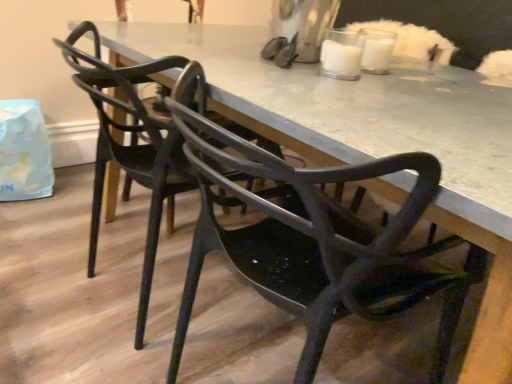
Question: Is matte black chair at center, which is counted as the 1th chair, starting from the front, in front of matte black chair at center, placed as the 1th chair when sorted from back to front?

Choices:
 (A) yes
 (B) no

Answer: (A)

Question: From a real-world perspective, is matte black chair at center, which is counted as the 1th chair, starting from the front, over matte black chair at center, placed as the 1th chair when sorted from back to front?

Choices:
 (A) no
 (B) yes

Answer: (A)

Question: Is matte black chair at center, which is counted as the 1th chair, starting from the front, far away from matte black chair at center, placed as the 1th chair when sorted from back to front?

Choices:
 (A) no
 (B) yes

Answer: (A)

Question: Considering the relative sizes of matte black chair at center, arranged as the 2th chair when viewed from the back, and matte black chair at center, placed as the 1th chair when sorted from back to front, in the image provided, is matte black chair at center, arranged as the 2th chair when viewed from the back, bigger than matte black chair at center, placed as the 1th chair when sorted from back to front,?

Choices:
 (A) yes
 (B) no

Answer: (B)

Question: Is matte black chair at center, which is counted as the 1th chair, starting from the front, outside of matte black chair at center, placed as the 1th chair when sorted from back to front?

Choices:
 (A) yes
 (B) no

Answer: (A)

Question: Is matte black chair at center, arranged as the 2th chair when viewed from the back, wider or thinner than matte black chair at center, placed as the 1th chair when sorted from back to front?

Choices:
 (A) thin
 (B) wide

Answer: (A)

Question: Is matte black chair at center, which is counted as the 1th chair, starting from the front, taller or shorter than matte black chair at center, acting as the 2th chair starting from the front?

Choices:
 (A) tall
 (B) short

Answer: (A)

Question: Considering the relative positions of matte black chair at center, which is counted as the 1th chair, starting from the front, and matte black chair at center, acting as the 2th chair starting from the front, in the image provided, is matte black chair at center, which is counted as the 1th chair, starting from the front, to the left or to the right of matte black chair at center, acting as the 2th chair starting from the front,?

Choices:
 (A) right
 (B) left

Answer: (A)

Question: Do you think matte black chair at center, arranged as the 2th chair when viewed from the back, is within matte black chair at center, acting as the 2th chair starting from the front, or outside of it?

Choices:
 (A) outside
 (B) inside

Answer: (A)

Question: Is matte black chair at center, arranged as the 2th chair when viewed from the back, taller or shorter than matte black table at center?

Choices:
 (A) short
 (B) tall

Answer: (B)

Question: In terms of width, does matte black chair at center, which is counted as the 1th chair, starting from the front, look wider or thinner when compared to matte black table at center?

Choices:
 (A) thin
 (B) wide

Answer: (A)

Question: Is matte black chair at center, which is counted as the 1th chair, starting from the front, bigger or smaller than matte black table at center?

Choices:
 (A) big
 (B) small

Answer: (B)

Question: Does point (291, 307) appear closer or farther from the camera than point (174, 29)?

Choices:
 (A) farther
 (B) closer

Answer: (B)

Question: Considering the positions of matte black chair at center, placed as the 1th chair when sorted from back to front, and matte black table at center in the image, is matte black chair at center, placed as the 1th chair when sorted from back to front, wider or thinner than matte black table at center?

Choices:
 (A) wide
 (B) thin

Answer: (B)

Question: Considering the positions of matte black chair at center, acting as the 2th chair starting from the front, and matte black table at center in the image, is matte black chair at center, acting as the 2th chair starting from the front, taller or shorter than matte black table at center?

Choices:
 (A) short
 (B) tall

Answer: (B)